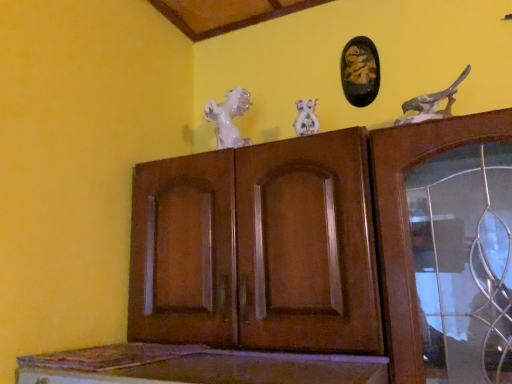
Question: Are white porcelain dog at center and speckled stone bird at upper right, which appears as the second animal when viewed from the left, making contact?

Choices:
 (A) no
 (B) yes

Answer: (A)

Question: Would you say white porcelain dog at center is a long distance from speckled stone bird at upper right, arranged as the first animal when viewed from the front?

Choices:
 (A) no
 (B) yes

Answer: (A)

Question: Is white porcelain dog at center smaller than speckled stone bird at upper right, which appears as the second animal when viewed from the left?

Choices:
 (A) yes
 (B) no

Answer: (A)

Question: Does white porcelain dog at center come behind speckled stone bird at upper right, the first animal in the right-to-left sequence?

Choices:
 (A) no
 (B) yes

Answer: (B)

Question: Is speckled stone bird at upper right, the first animal in the right-to-left sequence, completely or partially inside white porcelain dog at center?

Choices:
 (A) yes
 (B) no

Answer: (B)

Question: Is black glossy picture frame at upper center inside or outside of brown wood cupboard at center?

Choices:
 (A) inside
 (B) outside

Answer: (B)

Question: From a real-world perspective, is black glossy picture frame at upper center positioned above or below brown wood cupboard at center?

Choices:
 (A) below
 (B) above

Answer: (B)

Question: From the image's perspective, is black glossy picture frame at upper center above or below brown wood cupboard at center?

Choices:
 (A) above
 (B) below

Answer: (A)

Question: Considering their positions, is black glossy picture frame at upper center located in front of or behind brown wood cupboard at center?

Choices:
 (A) behind
 (B) front

Answer: (A)

Question: Considering the positions of point (294, 134) and point (353, 82), is point (294, 134) closer or farther from the camera than point (353, 82)?

Choices:
 (A) closer
 (B) farther

Answer: (A)

Question: Do you think white porcelain dog at center is within black glossy picture frame at upper center, or outside of it?

Choices:
 (A) inside
 (B) outside

Answer: (B)

Question: Relative to black glossy picture frame at upper center, is white porcelain dog at center in front or behind?

Choices:
 (A) behind
 (B) front

Answer: (B)

Question: From their relative heights in the image, would you say white porcelain dog at center is taller or shorter than black glossy picture frame at upper center?

Choices:
 (A) tall
 (B) short

Answer: (B)

Question: In the image, is brown wood cupboard at center on the left side or the right side of black glossy picture frame at upper center?

Choices:
 (A) right
 (B) left

Answer: (B)

Question: From the image's perspective, is brown wood cupboard at center located above or below black glossy picture frame at upper center?

Choices:
 (A) below
 (B) above

Answer: (A)